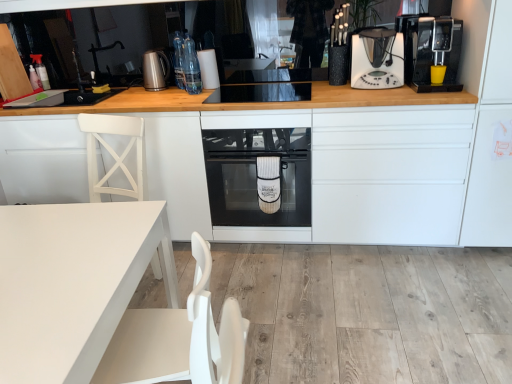
Question: Does white matte table at lower left, the 1th cabinetry viewed from the left, have a lesser width compared to clear glass bottles at upper center, placed as the 2th bottle when sorted from back to front?

Choices:
 (A) no
 (B) yes

Answer: (A)

Question: Would you say white matte table at lower left, the 2th cabinetry positioned from the right, contains clear glass bottles at upper center, placed as the 1th bottle when sorted from front to back?

Choices:
 (A) no
 (B) yes

Answer: (A)

Question: Is white matte table at lower left, the 1th cabinetry viewed from the left, not close to clear glass bottles at upper center, which is counted as the first bottle, starting from the right?

Choices:
 (A) no
 (B) yes

Answer: (A)

Question: From a real-world perspective, does white matte table at lower left, the 2th cabinetry positioned from the right, stand above clear glass bottles at upper center, placed as the 2th bottle when sorted from back to front?

Choices:
 (A) no
 (B) yes

Answer: (A)

Question: From a real-world perspective, is white matte table at lower left, the 2th cabinetry positioned from the right, beneath clear glass bottles at upper center, which is counted as the first bottle, starting from the right?

Choices:
 (A) yes
 (B) no

Answer: (A)

Question: Considering the relative sizes of white matte table at lower left, the 2th cabinetry positioned from the right, and clear glass bottles at upper center, the second bottle viewed from the left, in the image provided, is white matte table at lower left, the 2th cabinetry positioned from the right, shorter than clear glass bottles at upper center, the second bottle viewed from the left,?

Choices:
 (A) yes
 (B) no

Answer: (B)

Question: Does black plastic coffee machine at right appear on the right side of white matte table at lower left?

Choices:
 (A) yes
 (B) no

Answer: (A)

Question: Is black plastic coffee machine at right looking in the opposite direction of white matte table at lower left?

Choices:
 (A) yes
 (B) no

Answer: (B)

Question: Considering the relative sizes of black plastic coffee machine at right and white matte table at lower left in the image provided, is black plastic coffee machine at right shorter than white matte table at lower left?

Choices:
 (A) no
 (B) yes

Answer: (A)

Question: Is black plastic coffee machine at right smaller than white matte table at lower left?

Choices:
 (A) yes
 (B) no

Answer: (B)

Question: Is black plastic coffee machine at right aimed at white matte table at lower left?

Choices:
 (A) yes
 (B) no

Answer: (B)

Question: Is black plastic coffee machine at right in contact with white matte table at lower left?

Choices:
 (A) yes
 (B) no

Answer: (B)

Question: Is black plastic coffee machine at right at the left side of clear glass bottles at upper center, placed as the 1th bottle when sorted from front to back?

Choices:
 (A) no
 (B) yes

Answer: (A)